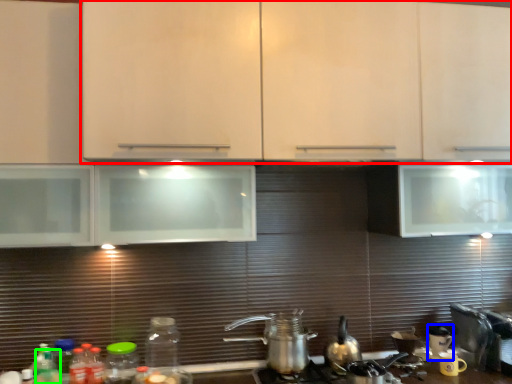
Question: Based on their relative distances, which object is farther from cabinetry (highlighted by a red box)? Choose from appliance (highlighted by a blue box) and bottle (highlighted by a green box).

Choices:
 (A) appliance
 (B) bottle

Answer: (B)